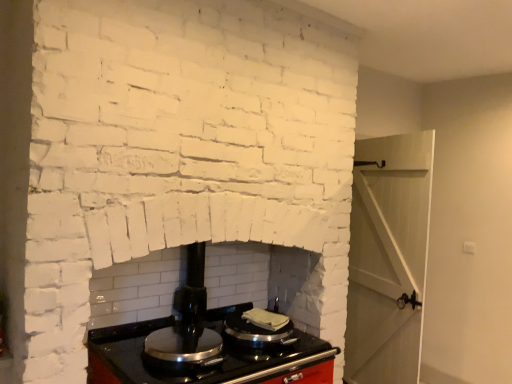
Question: Would you say metallic silver stove top at center is to the left or to the right of shiny black stove top at center in the picture?

Choices:
 (A) right
 (B) left

Answer: (A)

Question: Choose the correct answer: Is metallic silver stove top at center inside shiny black stove top at center or outside it?

Choices:
 (A) outside
 (B) inside

Answer: (A)

Question: From a real-world perspective, is metallic silver stove top at center positioned above or below shiny black stove top at center?

Choices:
 (A) below
 (B) above

Answer: (B)

Question: In terms of height, does shiny black stove top at center look taller or shorter compared to metallic silver stove top at center?

Choices:
 (A) short
 (B) tall

Answer: (A)

Question: From the image's perspective, is shiny black stove top at center located above or below metallic silver stove top at center?

Choices:
 (A) above
 (B) below

Answer: (B)

Question: From a real-world perspective, is shiny black stove top at center positioned above or below metallic silver stove top at center?

Choices:
 (A) above
 (B) below

Answer: (B)

Question: Is shiny black stove top at center bigger or smaller than metallic silver stove top at center?

Choices:
 (A) small
 (B) big

Answer: (A)